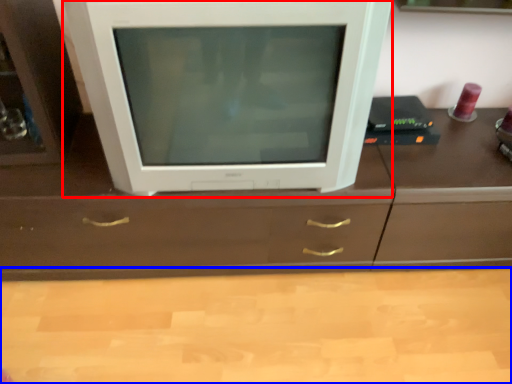
Question: Which object is further to the camera taking this photo, television (highlighted by a red box) or counter top (highlighted by a blue box)?

Choices:
 (A) television
 (B) counter top

Answer: (B)